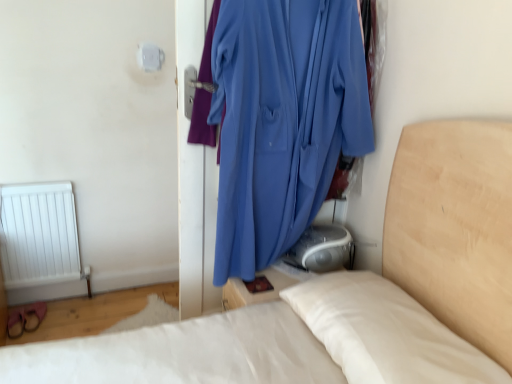
Identify the location of smooth white bed at center. (352, 294).

What is the approximate width of smooth white bed at center?

smooth white bed at center is 4.81 feet wide.

Describe the element at coordinates (352, 294) in the screenshot. Image resolution: width=512 pixels, height=384 pixels. I see `smooth white bed at center` at that location.

What is the approximate height of blue fabric at center?

It is 1.18 meters.

Describe the element at coordinates (278, 119) in the screenshot. I see `blue fabric at center` at that location.

Locate an element on the screen. The width and height of the screenshot is (512, 384). blue fabric at center is located at coordinates (278, 119).

Identify the location of smooth white bed at center. (352, 294).

Looking at this image, based on their positions, is smooth white bed at center located to the left or right of blue fabric at center?

Clearly, smooth white bed at center is on the left of blue fabric at center in the image.

Is smooth white bed at center further to the viewer compared to blue fabric at center?

No.

Which point is more forward, (x=185, y=355) or (x=277, y=252)?

The point (x=185, y=355) is closer.

From the image's perspective, is smooth white bed at center below blue fabric at center?

Yes, from the image's perspective, smooth white bed at center is below blue fabric at center.

From a real-world perspective, which object stands above the other?

blue fabric at center, from a real-world perspective.

Considering the relative sizes of smooth white bed at center and blue fabric at center in the image provided, is smooth white bed at center wider than blue fabric at center?

Yes, smooth white bed at center is wider than blue fabric at center.

Considering the relative sizes of smooth white bed at center and blue fabric at center in the image provided, is smooth white bed at center shorter than blue fabric at center?

Correct, smooth white bed at center is not as tall as blue fabric at center.

Based on their sizes in the image, would you say smooth white bed at center is bigger or smaller than blue fabric at center?

Clearly, smooth white bed at center is larger in size than blue fabric at center.

Is blue fabric at center surrounded by smooth white bed at center?

Actually, blue fabric at center is outside smooth white bed at center.

Is smooth white bed at center touching blue fabric at center?

No, smooth white bed at center is not beside blue fabric at center.

Is smooth white bed at center aimed at blue fabric at center?

No, smooth white bed at center is not facing towards blue fabric at center.

Identify the location of bed below the blue fabric at center (from the image's perspective). This screenshot has height=384, width=512. (352, 294).

Which is more to the right, blue fabric at center or smooth white bed at center?

blue fabric at center.

From the picture: Is the depth of blue fabric at center greater than that of smooth white bed at center?

Yes, the depth of blue fabric at center is greater than that of smooth white bed at center.

Does point (206, 75) lie behind point (445, 285)?

Yes, it is.

From the image's perspective, which one is positioned higher, blue fabric at center or smooth white bed at center?

From the image's view, blue fabric at center is above.

From a real-world perspective, who is located higher, blue fabric at center or smooth white bed at center?

blue fabric at center, from a real-world perspective.

Is blue fabric at center wider or thinner than smooth white bed at center?

Clearly, blue fabric at center has less width compared to smooth white bed at center.

Is blue fabric at center taller than smooth white bed at center?

Indeed, blue fabric at center has a greater height compared to smooth white bed at center.

Between blue fabric at center and smooth white bed at center, which one has larger size?

Answer: Bigger between the two is smooth white bed at center.

Based on the photo, is blue fabric at center not within smooth white bed at center?

Absolutely, blue fabric at center is external to smooth white bed at center.

Is blue fabric at center far from smooth white bed at center?

blue fabric at center is actually quite close to smooth white bed at center.

Does blue fabric at center turn towards smooth white bed at center?

Yes.

How different are the orientations of blue fabric at center and smooth white bed at center in degrees?

90.4 degrees separate the facing orientations of blue fabric at center and smooth white bed at center.

From the picture: How much distance is there between blue fabric at center and smooth white bed at center?

They are 18.94 inches apart.

Where is `curtain above the smooth white bed at center (from the image's perspective)`? Image resolution: width=512 pixels, height=384 pixels. curtain above the smooth white bed at center (from the image's perspective) is located at coordinates (278, 119).

Locate an element on the screen. This screenshot has width=512, height=384. bed located in front of the blue fabric at center is located at coordinates (352, 294).

Locate an element on the screen. This screenshot has width=512, height=384. bed that appears below the blue fabric at center (from a real-world perspective) is located at coordinates (352, 294).